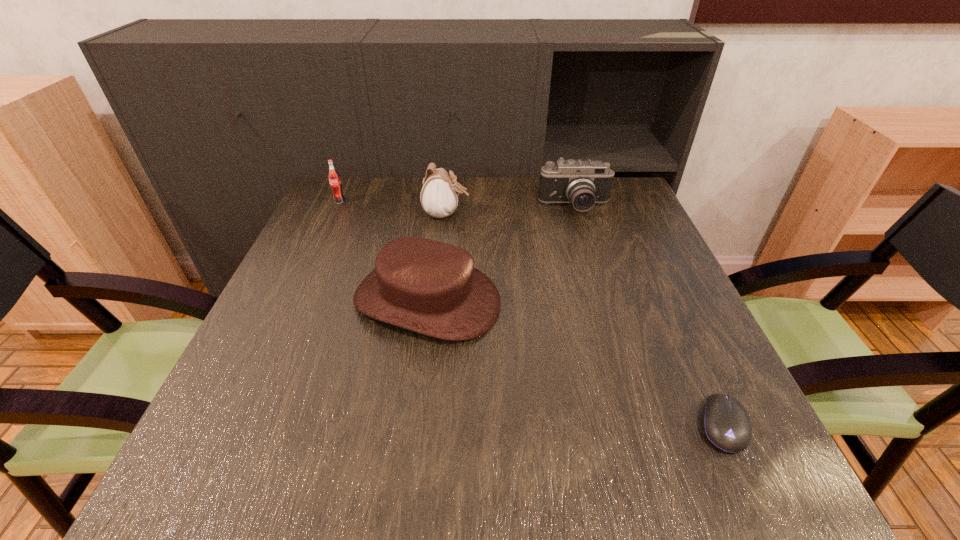
Where is `pouch`? pouch is located at coordinates (439, 196).

Locate an element on the screen. This screenshot has height=540, width=960. camera is located at coordinates (582, 183).

The image size is (960, 540). In order to click on soda bottle in this screenshot , I will do `click(334, 179)`.

Where is `hat`? hat is located at coordinates (429, 287).

At what (x,y) coordinates should I click in order to perform the action: click on the nearest object. Please return your answer as a coordinate pair (x, y). Looking at the image, I should click on (726, 424).

Locate an element on the screen. This screenshot has width=960, height=540. the shortest object is located at coordinates (726, 424).

Image resolution: width=960 pixels, height=540 pixels. I want to click on free point located 0.160m on the front-facing side of the pouch, so [529, 214].

Identify the location of vacant space located on the front-facing side of the camera. The height and width of the screenshot is (540, 960). (585, 238).

Identify the location of free spot located on the label of the leftmost object. (324, 235).

Identify the location of free location located 0.050m on the left of the fourth farthest object. (330, 300).